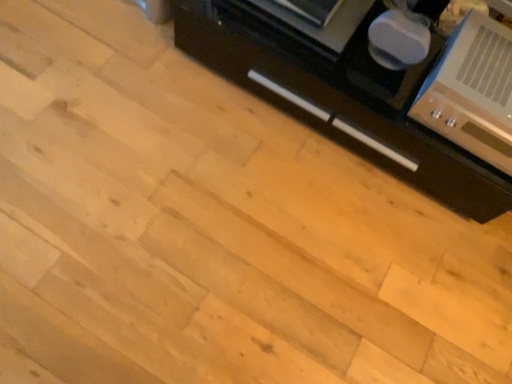
Question: From a real-world perspective, relative to metallic silver stereo at upper right, is black matte cabinet at right vertically above or below?

Choices:
 (A) above
 (B) below

Answer: (B)

Question: Is black matte cabinet at right in front of or behind metallic silver stereo at upper right in the image?

Choices:
 (A) behind
 (B) front

Answer: (A)

Question: Based on their positions, is black matte cabinet at right located to the left or right of metallic silver stereo at upper right?

Choices:
 (A) left
 (B) right

Answer: (A)

Question: Is point (456, 89) closer or farther from the camera than point (429, 152)?

Choices:
 (A) farther
 (B) closer

Answer: (B)

Question: Looking at the image, does metallic silver stereo at upper right seem bigger or smaller compared to black matte cabinet at right?

Choices:
 (A) small
 (B) big

Answer: (A)

Question: From the image's perspective, is metallic silver stereo at upper right located above or below black matte cabinet at right?

Choices:
 (A) below
 (B) above

Answer: (A)

Question: Considering their positions, is metallic silver stereo at upper right located in front of or behind black matte cabinet at right?

Choices:
 (A) front
 (B) behind

Answer: (A)